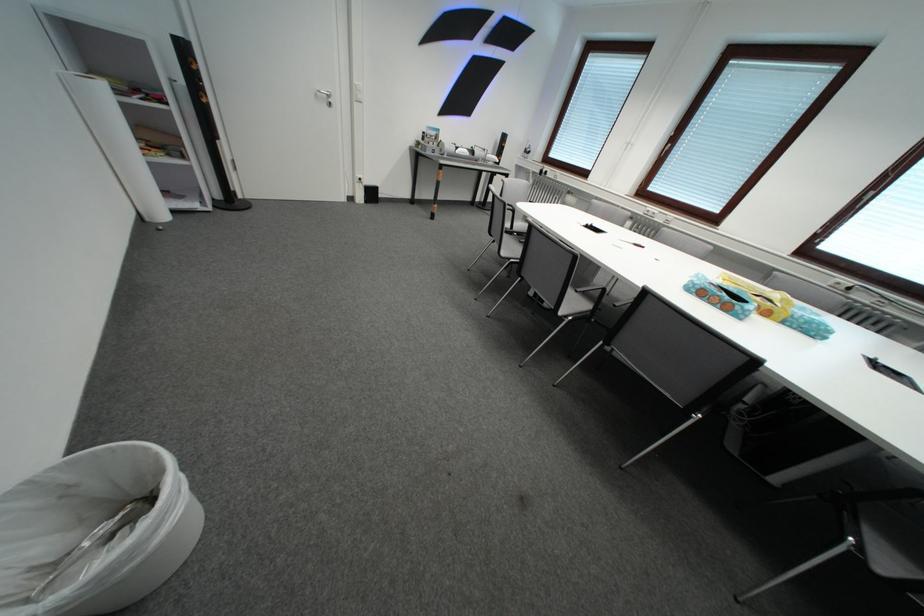
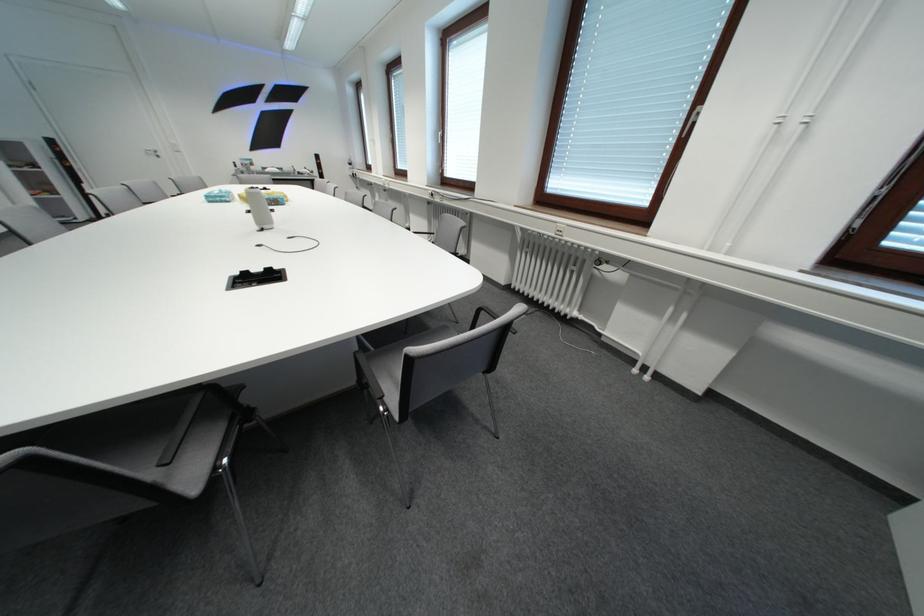
Question: I am providing you with two images of the same scene from different viewpoints. Please identify which objects are invisible in image2.

Choices:
 (A) power adapter box
 (B) blue plastic container
 (C) black chair armrest
 (D) black floor speaker

Answer: (D)